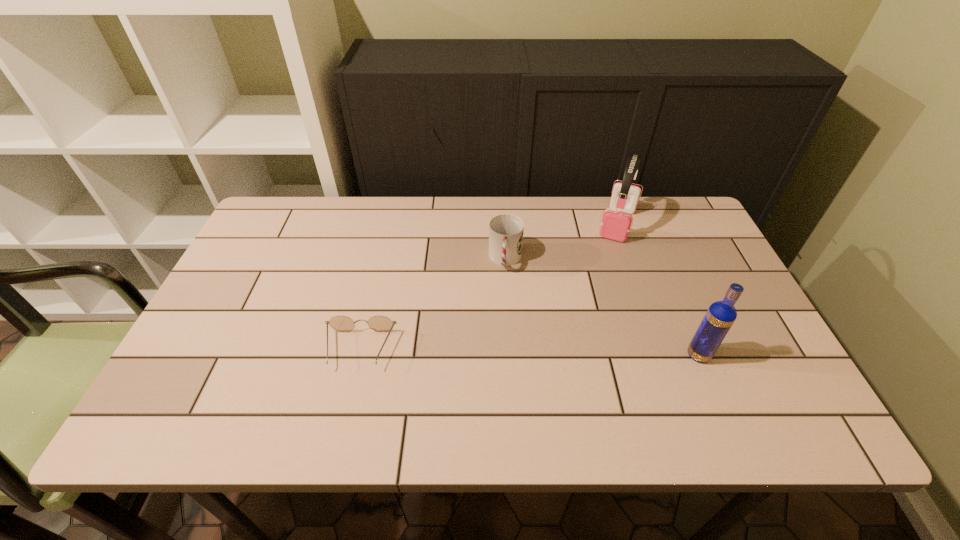
At what (x,y) coordinates should I click in order to perform the action: click on vacant area that satisfies the following two spatial constraints: 1. on the front side of the vodka; 2. on the right side of the third object from right to left. Please return your answer as a coordinate pair (x, y). Looking at the image, I should click on (511, 355).